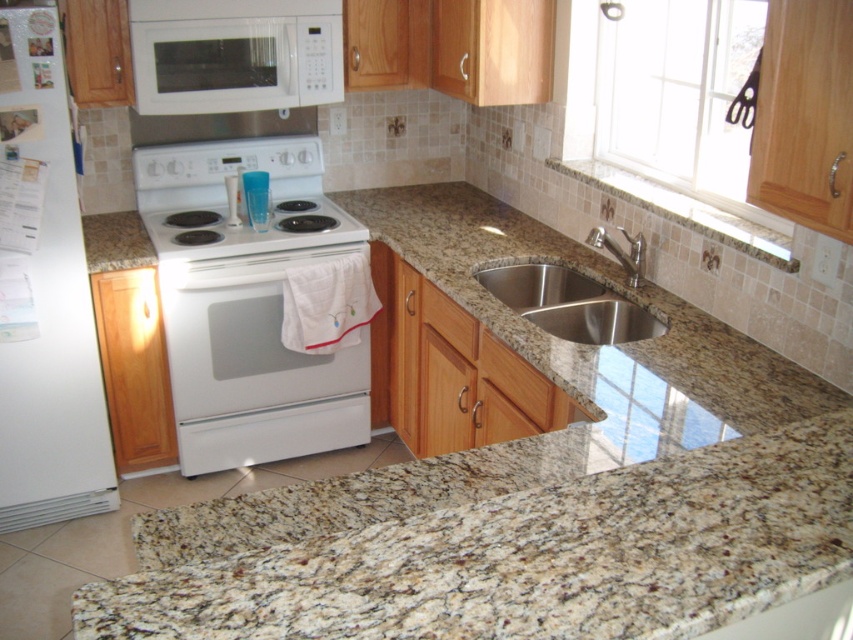
Between granite countertop at center and white glossy oven at center, which one has more height?

With more height is granite countertop at center.

In the scene shown: Does granite countertop at center come in front of white glossy oven at center?

Yes, it is in front of white glossy oven at center.

The height and width of the screenshot is (640, 853). Describe the element at coordinates (525, 528) in the screenshot. I see `granite countertop at center` at that location.

Identify the location of granite countertop at center. The width and height of the screenshot is (853, 640). (525, 528).

Is white glossy electric stove at center further to the viewer compared to stainless steel sink at lower center?

Yes, it is behind stainless steel sink at lower center.

Is point (276, 250) farther from camera compared to point (524, 268)?

Yes.

What are the coordinates of `white glossy electric stove at center` in the screenshot? It's located at (236, 198).

Does white matte refrigerator at left appear on the right side of white glossy exhaust hood at upper center?

Incorrect, white matte refrigerator at left is not on the right side of white glossy exhaust hood at upper center.

Is white matte refrigerator at left above white glossy exhaust hood at upper center?

No, white matte refrigerator at left is not above white glossy exhaust hood at upper center.

Between point (103, 467) and point (264, 122), which one is positioned in front?

Point (103, 467)

Find the location of a particular element. Image resolution: width=853 pixels, height=640 pixels. white matte refrigerator at left is located at coordinates (44, 294).